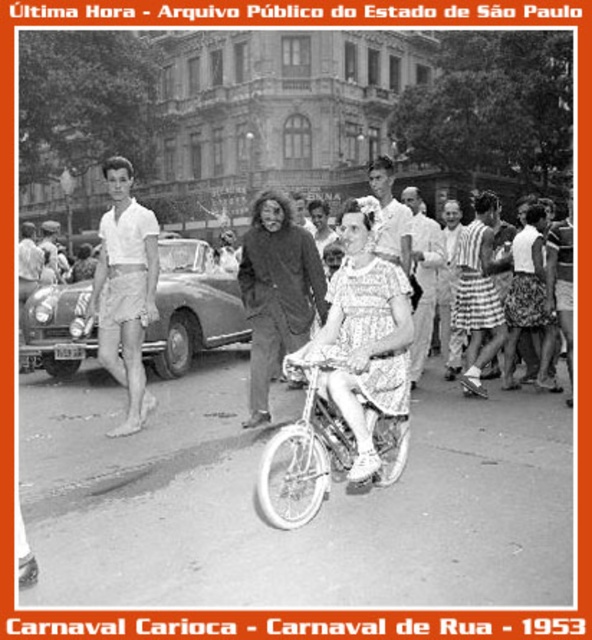
Question: Which object is the farthest from the smooth white shirt at center?

Choices:
 (A) dark brown wool coat at center
 (B) metallic silver monocycle at center

Answer: (B)

Question: Which of these objects is positioned farthest from the white matte bicycle at center?

Choices:
 (A) dark brown wool coat at center
 (B) dress fabric bicycle at center
 (C) metallic silver monocycle at center

Answer: (C)

Question: Is white cotton shirt at center to the left of smooth white shirt at center from the viewer's perspective?

Choices:
 (A) no
 (B) yes

Answer: (A)

Question: Which of the following is the closest to the observer?

Choices:
 (A) (297, 250)
 (B) (345, 467)

Answer: (B)

Question: Does metallic silver monocycle at center lie behind white cotton shorts at left?

Choices:
 (A) no
 (B) yes

Answer: (B)

Question: Is dark brown wool coat at center in front of smooth white shirt at center?

Choices:
 (A) yes
 (B) no

Answer: (A)